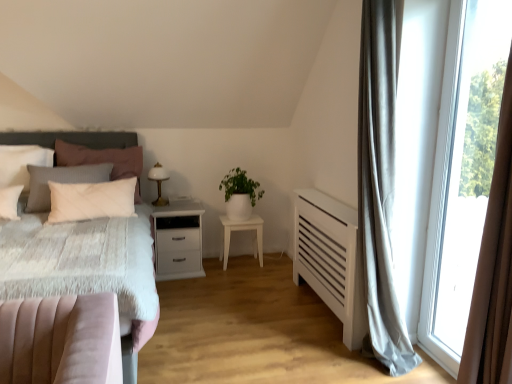
Image resolution: width=512 pixels, height=384 pixels. In order to click on free location in front of white matte nightstand at center, which is the first nightstand from left to right in this screenshot , I will do `click(188, 290)`.